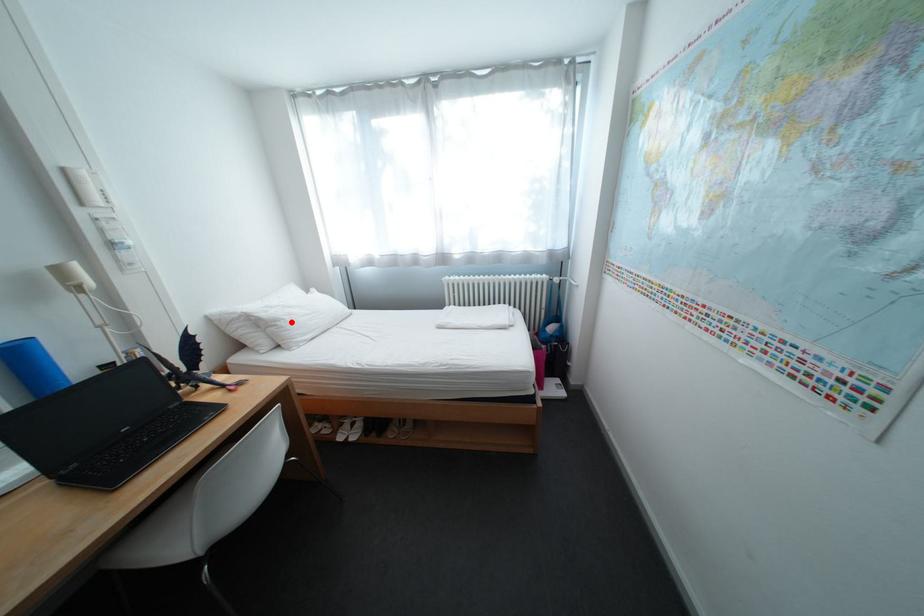
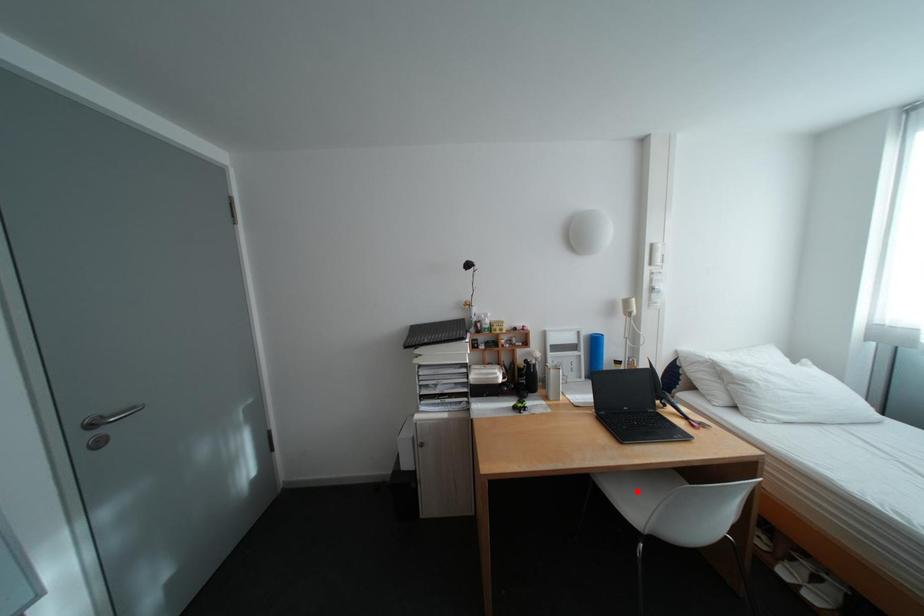
I am providing you with two images of the same scene from different viewpoints. A red point is marked on the first image and another point is marked on the second image. Does the point marked in image1 correspond to the same location as the one in image2?

No